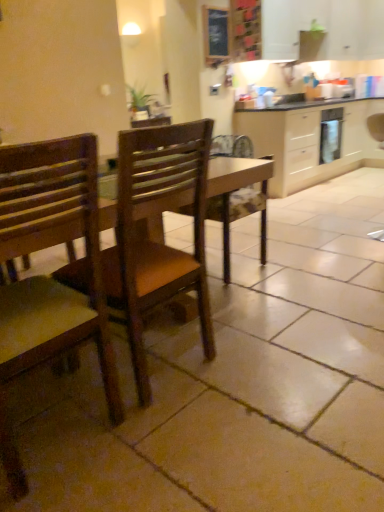
Find the location of a particular element. The image size is (384, 512). free spot below wooden chair at left, the second chair in the right-to-left sequence (from a real-world perspective) is located at coordinates (58, 424).